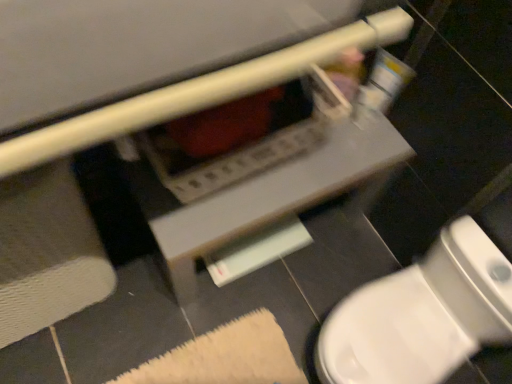
What are the coordinates of `matte plastic tray at center` in the screenshot? It's located at (260, 196).

This screenshot has height=384, width=512. Describe the element at coordinates (260, 196) in the screenshot. I see `matte plastic tray at center` at that location.

What is the approximate width of matte plastic tray at center?

40.38 centimeters.

Image resolution: width=512 pixels, height=384 pixels. Identify the location of matte plastic tray at center. (260, 196).